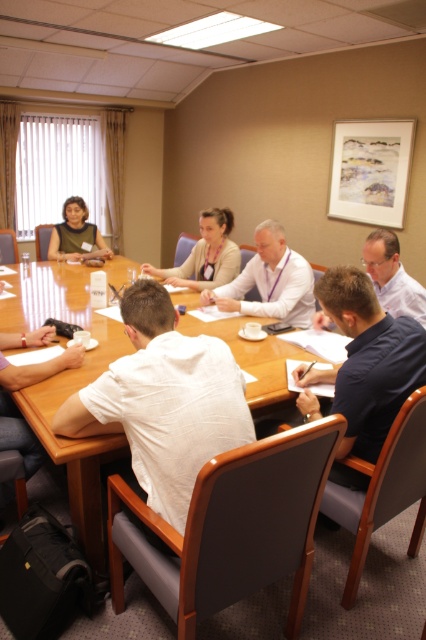
You are sitting at the rectangular wooden conference table in the meeting room. You notice two points marked on the table surface. The first point is at coordinate position [117,451] and the second point is at [425,304]. If you want to place a small object exactly halfway between these two points, where would you place it?

To find the midpoint between the two points, calculate the average of their x and y coordinates. The midpoint would be at coordinates 0.5905, 0.6365.

Please provide the 2D coordinates of the white shirt at center in the image. The coordinates should be in the format of a tuple with two decimal numbers, like this example format of a coordinate pair. Your answer should only contain the coordinate values without any additional text or explanation. The coordinate system is such that the origin is at the bottom left corner of the image, with the x and y axes increasing to the right and up respectively. The maximum x and y values are both 1.0. The coordinate 0

The 2D coordinates of the white shirt at center are at point (270, 282). So the answer is (270, 282).

You are sitting at the wooden table at center and want to pass a document to the person wearing the light blue shirt at center. In which direction should you pass the document?

The wooden table at center is to the left of the light blue shirt at center, so you should pass the document to your right to reach the person wearing the light blue shirt at center.